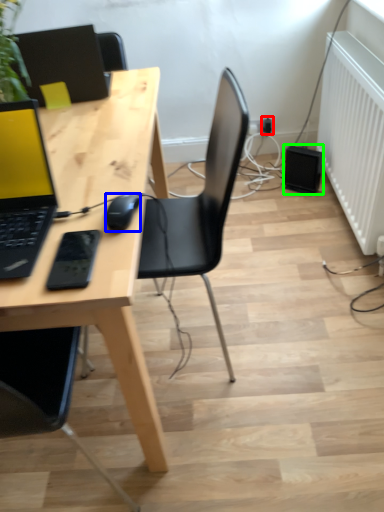
Question: Estimate the real-world distances between objects in this image. Which object is farther from electric outlet (highlighted by a red box), mouse (highlighted by a blue box) or speaker (highlighted by a green box)?

Choices:
 (A) mouse
 (B) speaker

Answer: (A)